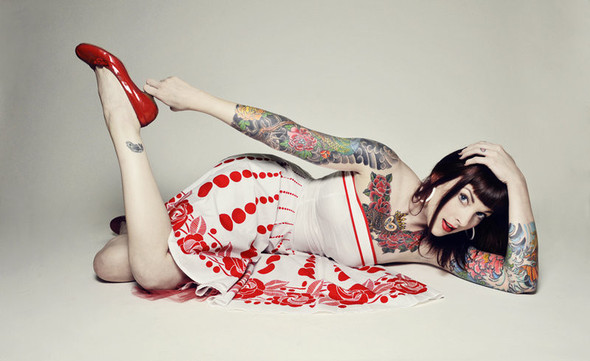
Find the location of `floor`. floor is located at coordinates (198, 332).